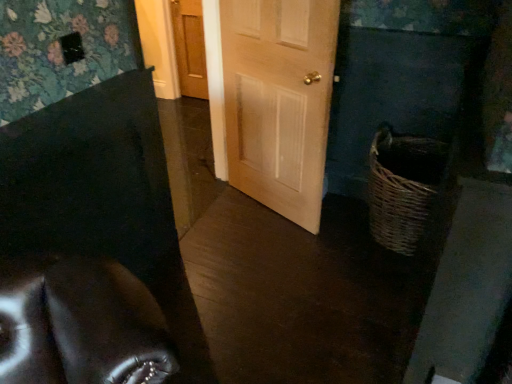
Question: Is wooden door at center, the second door when ordered from bottom to top, positioned behind light wood door at center, the 2th door positioned from the top?

Choices:
 (A) no
 (B) yes

Answer: (B)

Question: Is wooden door at center, the second door when ordered from bottom to top, smaller than light wood door at center, which appears as the 2th door when viewed from the back?

Choices:
 (A) yes
 (B) no

Answer: (A)

Question: Can you confirm if wooden door at center, the second door when ordered from bottom to top, is thinner than light wood door at center, which appears as the 2th door when viewed from the back?

Choices:
 (A) no
 (B) yes

Answer: (B)

Question: From the image's perspective, is wooden door at center, the first door when ordered from back to front, located above light wood door at center, the 2th door positioned from the top?

Choices:
 (A) yes
 (B) no

Answer: (A)

Question: Is wooden door at center, positioned as the second door in front-to-back order, aimed at light wood door at center, the 2th door positioned from the top?

Choices:
 (A) no
 (B) yes

Answer: (A)

Question: Would you consider wooden door at center, the first door viewed from the top, to be distant from light wood door at center, which is the 1th door from front to back?

Choices:
 (A) yes
 (B) no

Answer: (A)

Question: Is wooden door at center, which is counted as the first door, starting from the left, surrounded by woven brown basket at lower right?

Choices:
 (A) no
 (B) yes

Answer: (A)

Question: Can you confirm if woven brown basket at lower right is wider than wooden door at center, the first door viewed from the top?

Choices:
 (A) yes
 (B) no

Answer: (A)

Question: From a real-world perspective, does woven brown basket at lower right stand above wooden door at center, positioned as the second door in front-to-back order?

Choices:
 (A) no
 (B) yes

Answer: (A)

Question: Is woven brown basket at lower right outside of wooden door at center, the first door viewed from the top?

Choices:
 (A) no
 (B) yes

Answer: (B)

Question: Is woven brown basket at lower right facing away from wooden door at center, the second door positioned from the right?

Choices:
 (A) no
 (B) yes

Answer: (A)

Question: Is woven brown basket at lower right smaller than wooden door at center, the first door viewed from the top?

Choices:
 (A) no
 (B) yes

Answer: (A)

Question: Can you confirm if wooden door at center, the first door when ordered from back to front, is wider than woven brown basket at lower right?

Choices:
 (A) yes
 (B) no

Answer: (B)